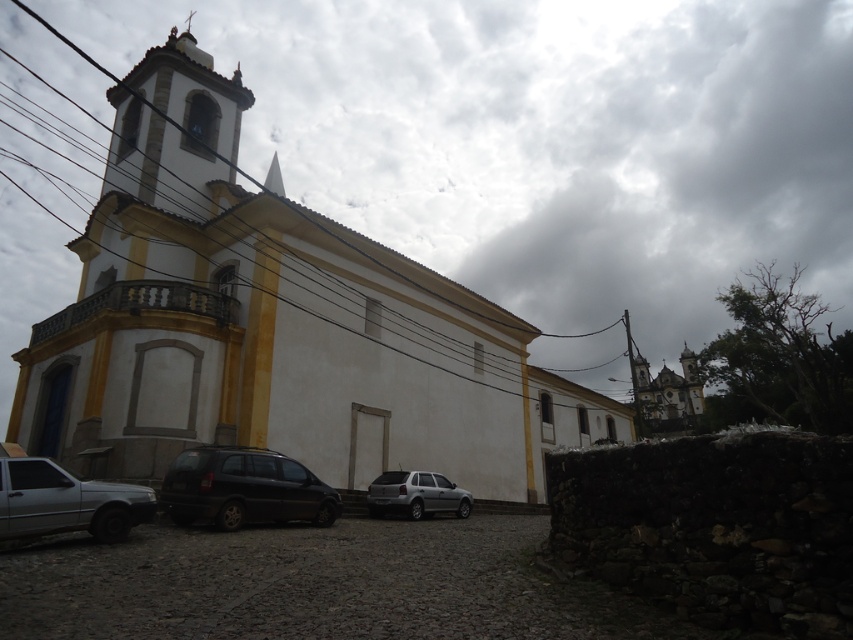
Question: In this image, where is white smooth church at center located relative to silver metallic car at lower left?

Choices:
 (A) right
 (B) left

Answer: (B)

Question: Considering the relative positions of black matte van at lower left and silver metallic car at lower left in the image provided, where is black matte van at lower left located with respect to silver metallic car at lower left?

Choices:
 (A) above
 (B) below

Answer: (B)

Question: Which of the following is the closest to the observer?

Choices:
 (A) (422, 484)
 (B) (186, 500)

Answer: (B)

Question: Which object is closer to the camera taking this photo?

Choices:
 (A) white smooth church at center
 (B) silver metallic car at lower left
 (C) satin silver suv at center

Answer: (B)

Question: Which point is closer to the camera?

Choices:
 (A) white smooth church at center
 (B) satin silver suv at center

Answer: (A)

Question: Can you confirm if black matte van at lower left is wider than satin silver suv at center?

Choices:
 (A) yes
 (B) no

Answer: (A)